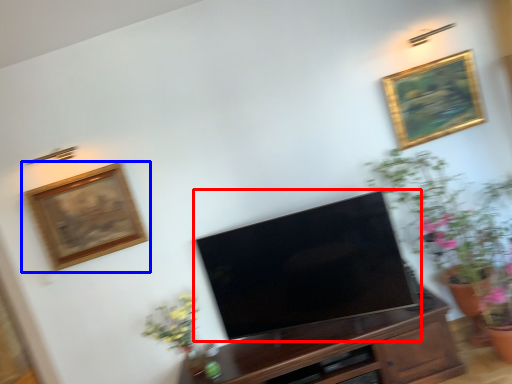
Question: Among these objects, which one is farthest to the camera, television (highlighted by a red box) or picture frame (highlighted by a blue box)?

Choices:
 (A) television
 (B) picture frame

Answer: (B)